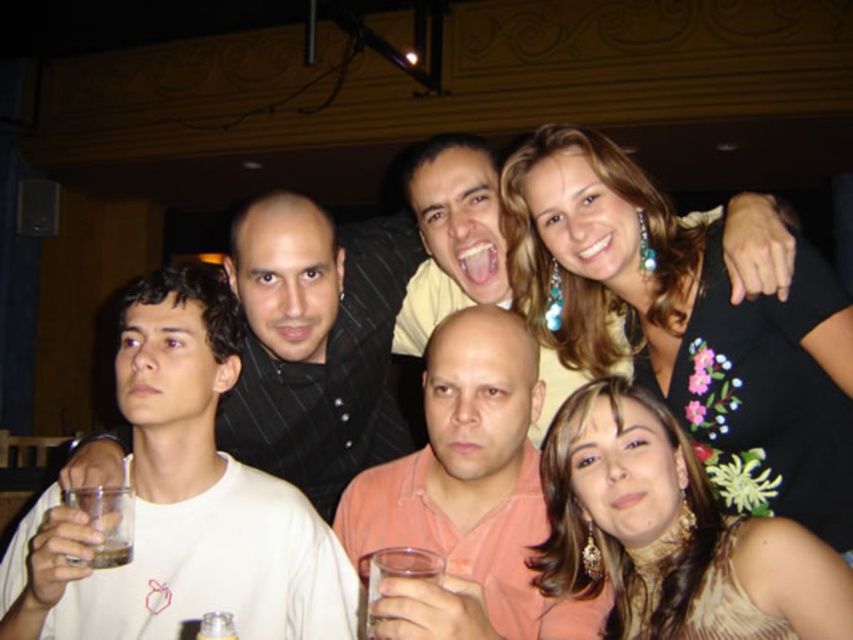
Question: Which point is farther to the camera?

Choices:
 (A) translucent glass at lower left
 (B) orange cotton shirt at center
 (C) brown textured dress at center

Answer: (C)

Question: Is white matte shirt at left thinner than translucent glass at lower left?

Choices:
 (A) no
 (B) yes

Answer: (A)

Question: Which object appears closest to the camera in this image?

Choices:
 (A) clear glass at lower left
 (B) black floral dress at upper right

Answer: (A)

Question: Is brown textured dress at center wider than orange cotton shirt at center?

Choices:
 (A) yes
 (B) no

Answer: (B)

Question: Which is nearer to the white matte shirt at left?

Choices:
 (A) orange cotton shirt at center
 (B) clear glass at lower left
 (C) clear glass at lower center
 (D) black floral dress at upper right

Answer: (B)

Question: Does black floral dress at upper right appear under clear glass at lower center?

Choices:
 (A) no
 (B) yes

Answer: (A)